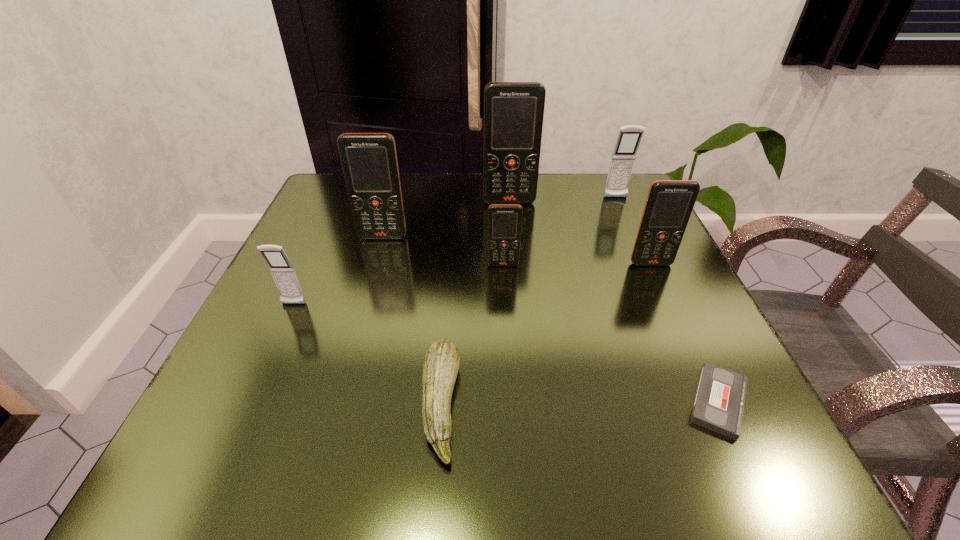
You are a GUI agent. You are given a task and a screenshot of the screen. Output one action in this format:
    pyautogui.click(x=<x>, y=<y>)
    Task: Click on the cellular telephone that is the closest one to the tallest object
    
    Given the screenshot: What is the action you would take?
    pyautogui.click(x=624, y=154)

Where is `cellular telephone that stands as the fifth closest to the videotape`? Image resolution: width=960 pixels, height=540 pixels. cellular telephone that stands as the fifth closest to the videotape is located at coordinates (369, 160).

Identify which orange cellular telephone is the third nearest to the biggest orange cellular telephone. Please provide its 2D coordinates. Your answer should be formatted as a tuple, i.e. [(x, y)], where the tuple contains the x and y coordinates of a point satisfying the conditions above.

[(669, 204)]

I want to click on the closest orange cellular telephone to the rightmost orange cellular telephone, so click(504, 220).

Where is `vacant area in the image that satisfies the following two spatial constraints: 1. on the front-facing side of the right gray cellular telephone; 2. at the stem end of the green zucchini`? The height and width of the screenshot is (540, 960). vacant area in the image that satisfies the following two spatial constraints: 1. on the front-facing side of the right gray cellular telephone; 2. at the stem end of the green zucchini is located at coordinates [x=708, y=405].